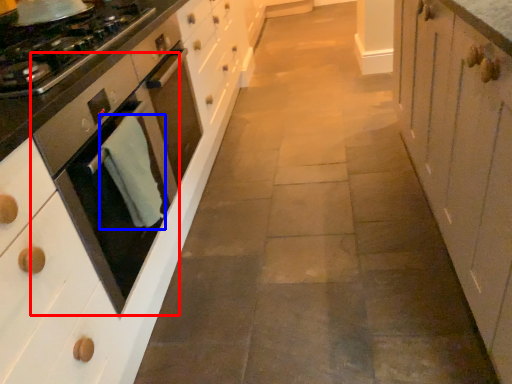
Question: Which of the following is the farthest to the observer, home appliance (highlighted by a red box) or material (highlighted by a blue box)?

Choices:
 (A) home appliance
 (B) material

Answer: (B)